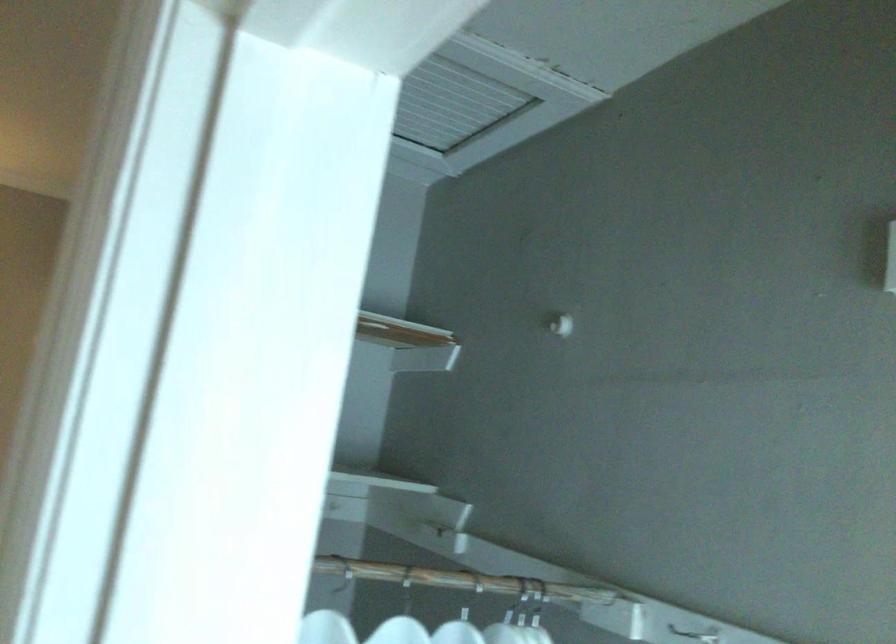
Where would you open the ceiling vent cover? Please return your answer as a coordinate pair (x, y).

(477, 106)